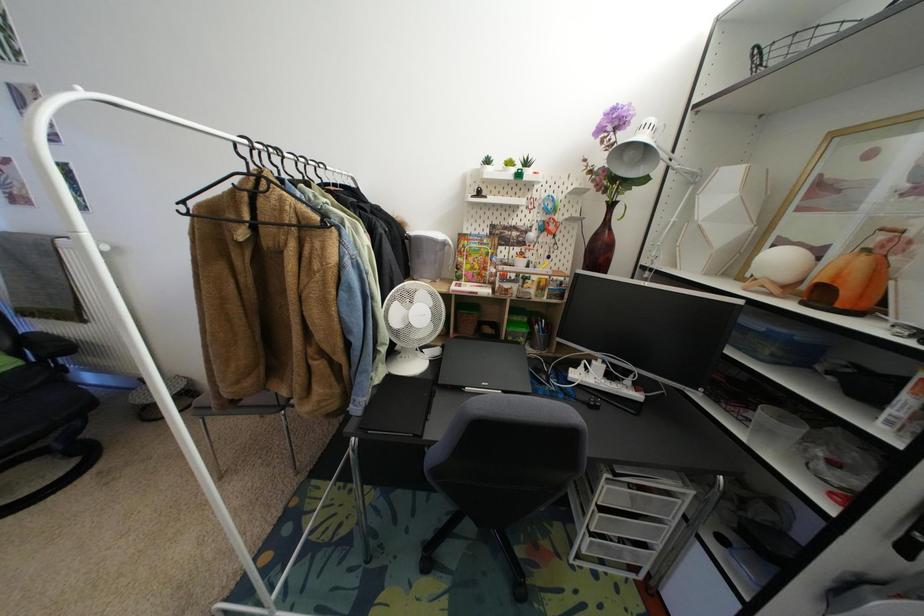
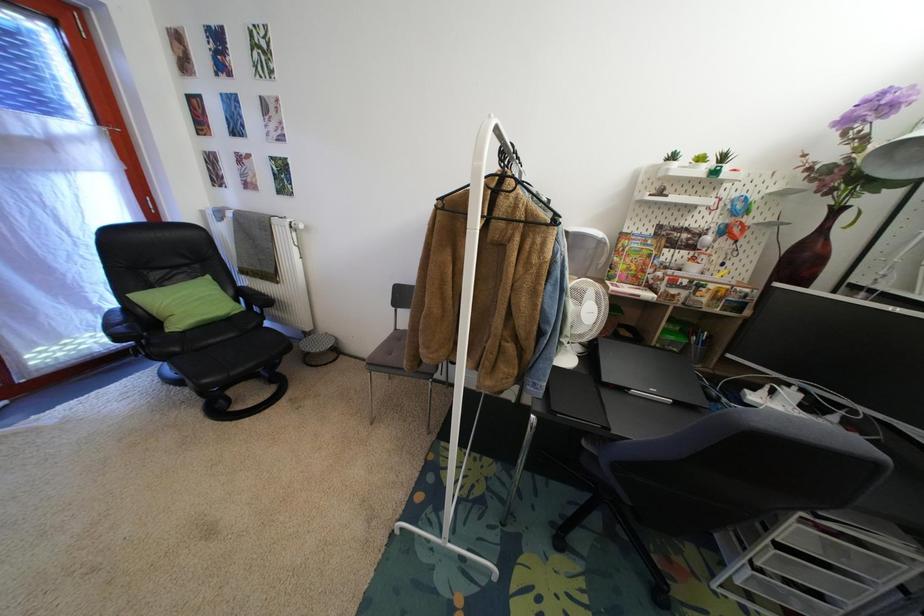
Question: The camera is either moving clockwise (left) or counter-clockwise (right) around the object. The first image is from the beginning of the video and the second image is from the end. Is the camera moving left or right when shooting the video?

Choices:
 (A) Left
 (B) Right

Answer: (B)